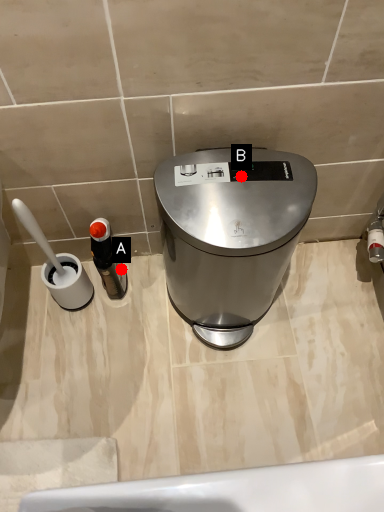
Question: Two points are circled on the image, labeled by A and B beside each circle. Which of the following is the closest to the observer?

Choices:
 (A) A is closer
 (B) B is closer

Answer: (B)